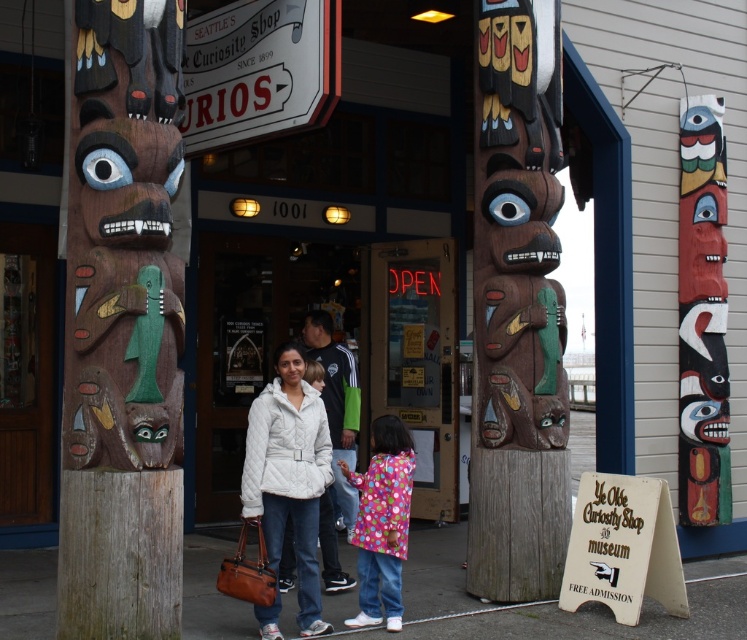
Based on the photo, you are standing in front of the entrance to Ye Olde Curiosity Shop and see the wooden totem pole at left and the wooden totem pole at center. Which one is positioned further to the left side of the entrance?

The wooden totem pole at left is positioned further to the left side of the entrance compared to the wooden totem pole at center.

You are standing at the entrance of the shop. Where is the wooden totem pole at left located in relation to the entrance?

The wooden totem pole at left is located at point (123,330) relative to the entrance.